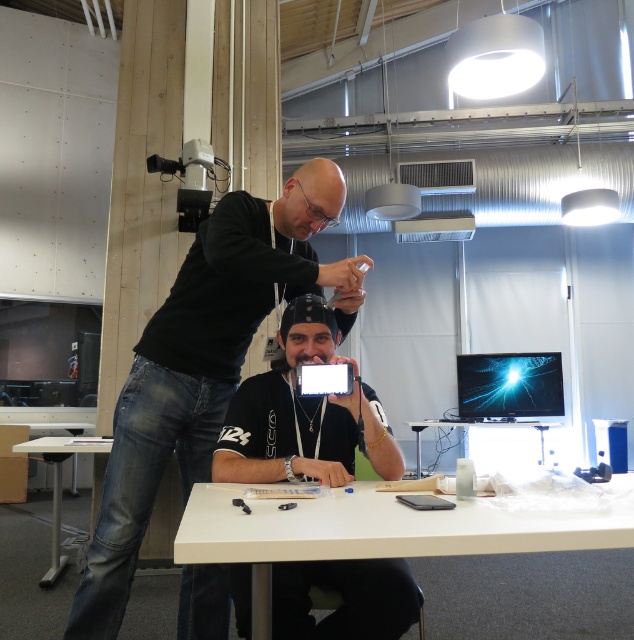
Question: Which point appears closest to the camera in this image?

Choices:
 (A) [301, 634]
 (B) [314, 548]
 (C) [418, 445]

Answer: (B)

Question: Which point appears farthest from the camera in this image?

Choices:
 (A) tap(441, 428)
 (B) tap(259, 205)
 (C) tap(242, 545)

Answer: (A)

Question: Is black matte phone at center below white glossy table at lower center?

Choices:
 (A) yes
 (B) no

Answer: (B)

Question: Is black matte phone at center smaller than white plastic table at center?

Choices:
 (A) no
 (B) yes

Answer: (B)

Question: Does black matte shirt at center have a lesser width compared to white glossy table at lower center?

Choices:
 (A) yes
 (B) no

Answer: (A)

Question: Which object is positioned closest to the black matte phone at center?

Choices:
 (A) black matte shirt at center
 (B) white glossy table at lower center
 (C) white plastic table at center
 (D) white plastic table at lower left

Answer: (A)